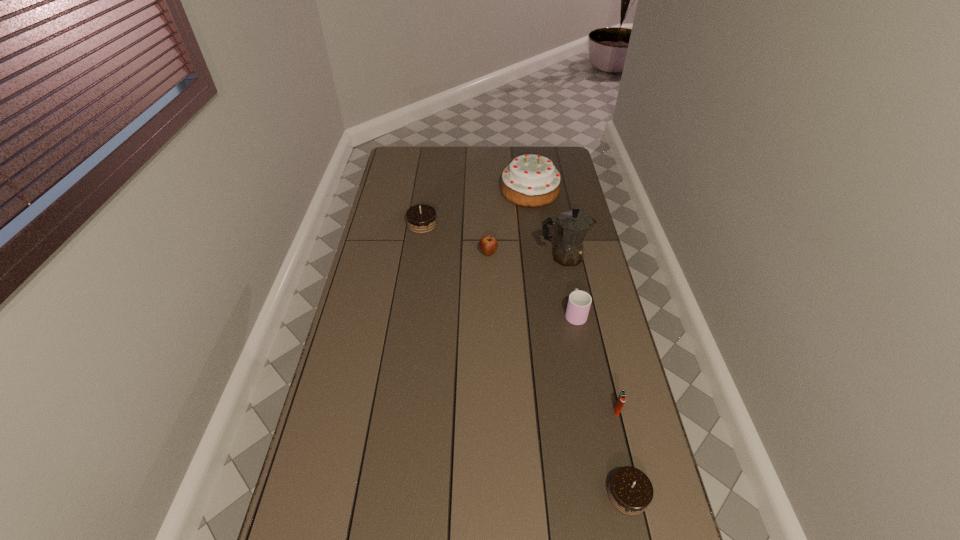
Please mark a free spot for a new chocolate_cake to balance the arrangement. Please provide its 2D coordinates. Your answer should be formatted as a tuple, i.e. [(x, y)], where the tuple contains the x and y coordinates of a point satisfying the conditions above.

[(498, 325)]